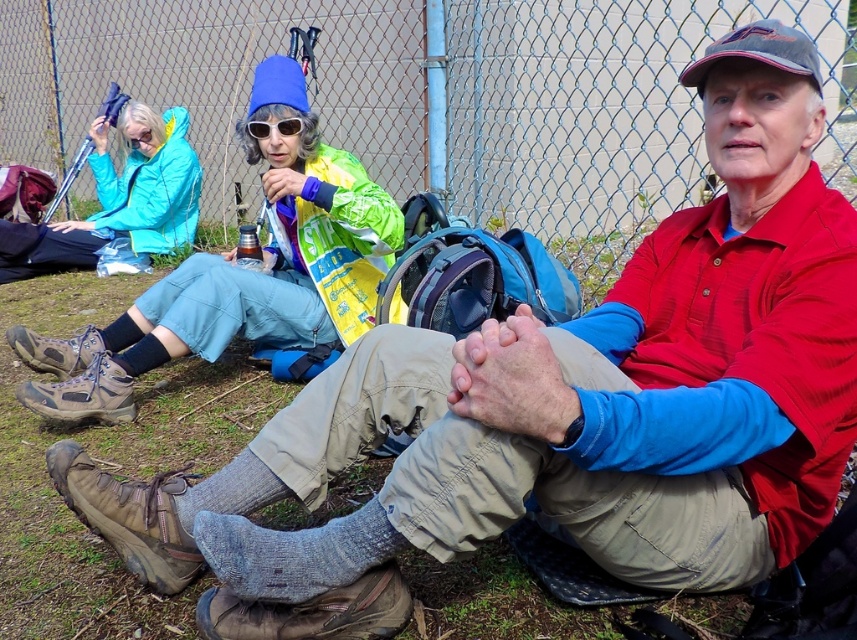
Does shiny blue beanie at upper left appear on the left side of matte blue jacket at left?

In fact, shiny blue beanie at upper left is to the right of matte blue jacket at left.

Can you confirm if shiny blue beanie at upper left is positioned above matte blue jacket at left?

No.

Who is more distant from viewer, (292, 324) or (132, 180)?

Positioned behind is point (132, 180).

You are a GUI agent. You are given a task and a screenshot of the screen. Output one action in this format:
    pyautogui.click(x=<x>, y=<y>)
    Task: Click on the shiny blue beanie at upper left
    
    Given the screenshot: What is the action you would take?
    (x=238, y=273)

Is shiny blue beanie at upper left bigger than sunglasses at center?

Indeed, shiny blue beanie at upper left has a larger size compared to sunglasses at center.

Who is more forward, (276,243) or (268,129)?

Point (268,129) is more forward.

I want to click on shiny blue beanie at upper left, so click(x=238, y=273).

Based on the photo, can you confirm if metal chain-link fence at upper center is smaller than sunglasses at center?

Incorrect, metal chain-link fence at upper center is not smaller in size than sunglasses at center.

Find the location of a particular element. The height and width of the screenshot is (640, 857). metal chain-link fence at upper center is located at coordinates pos(428,99).